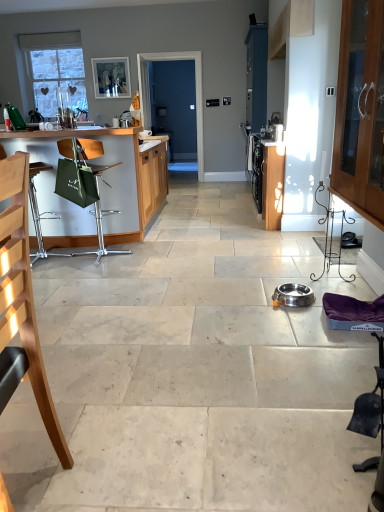
Locate an element on the screen. The image size is (384, 512). free space between black fabric swivel chair at lower right and green fabric chair at left, placed as the first chair when sorted from back to front is located at coordinates (188, 329).